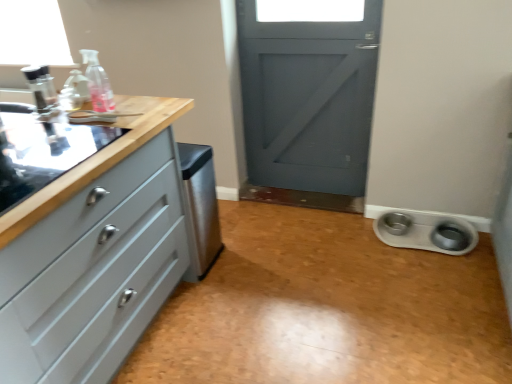
At what (x,y) coordinates should I click in order to perform the action: click on blank space situated above white glossy pet bowls at lower right (from a real-world perspective). Please return your answer as a coordinate pair (x, y). The image size is (512, 384). Looking at the image, I should click on (334, 306).